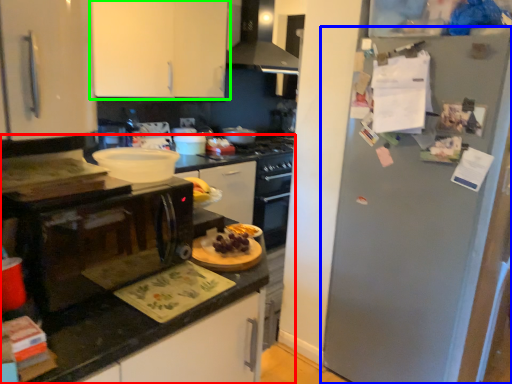
Question: Which is nearer to the countertop (highlighted by a red box)? refrigerator (highlighted by a blue box) or cabinetry (highlighted by a green box).

Choices:
 (A) refrigerator
 (B) cabinetry

Answer: (A)